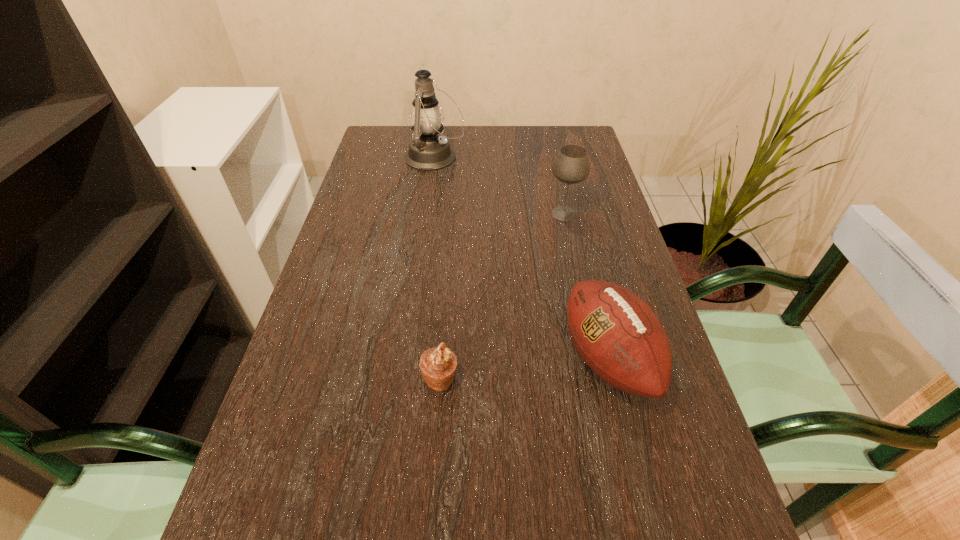
Where is `free spot that satisfies the following two spatial constraints: 1. on the front side of the oil lamp; 2. on the right side of the third nearest object`? This screenshot has height=540, width=960. free spot that satisfies the following two spatial constraints: 1. on the front side of the oil lamp; 2. on the right side of the third nearest object is located at coordinates (426, 213).